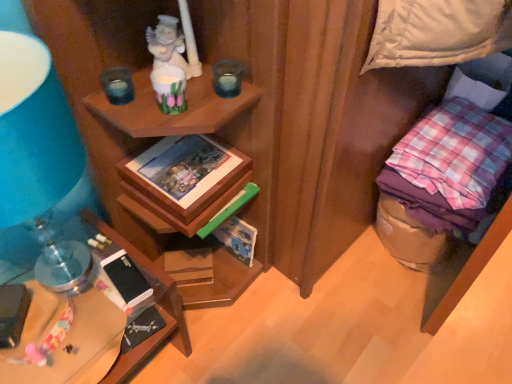
This screenshot has width=512, height=384. I want to click on vacant space situated on the left part of black matte mobile phone at lower left, the 2th mobile phone viewed from the left, so click(49, 285).